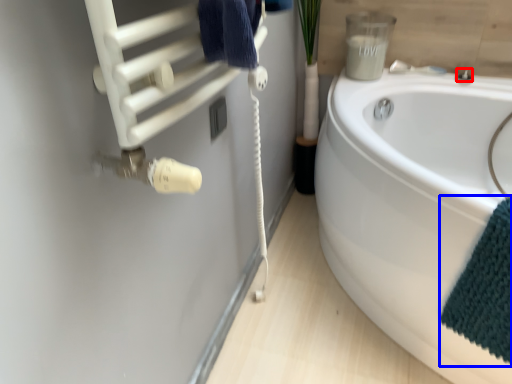
Question: Which object appears farthest to the camera in this image, faucet (highlighted by a red box) or bath towel (highlighted by a blue box)?

Choices:
 (A) faucet
 (B) bath towel

Answer: (A)